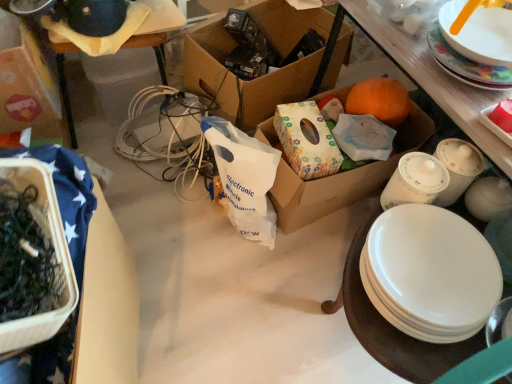
Where is `vacant area on top of white glossy plate at lower right, placed as the 1th plate when sorted from bottom to top (from a real-world perspective)`? The height and width of the screenshot is (384, 512). vacant area on top of white glossy plate at lower right, placed as the 1th plate when sorted from bottom to top (from a real-world perspective) is located at coordinates click(437, 261).